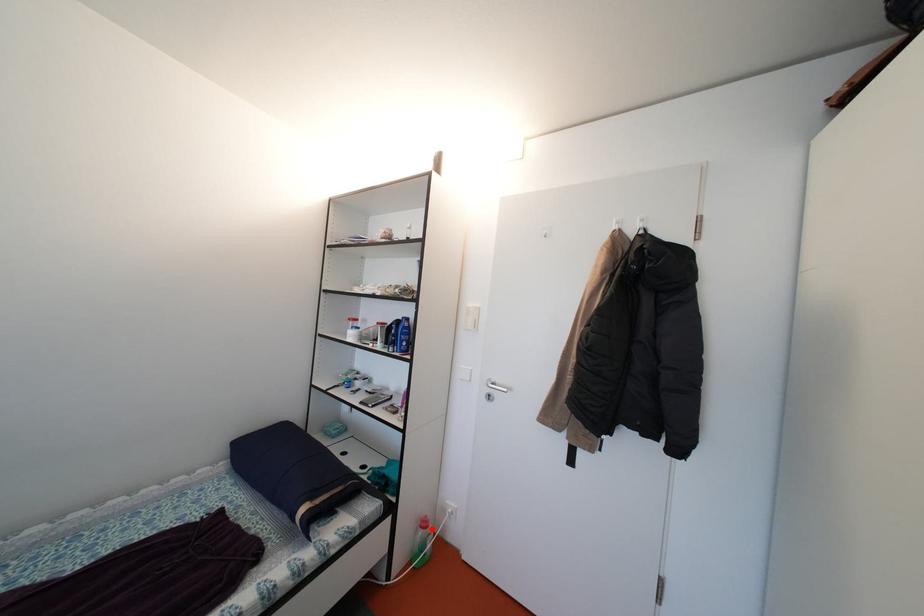
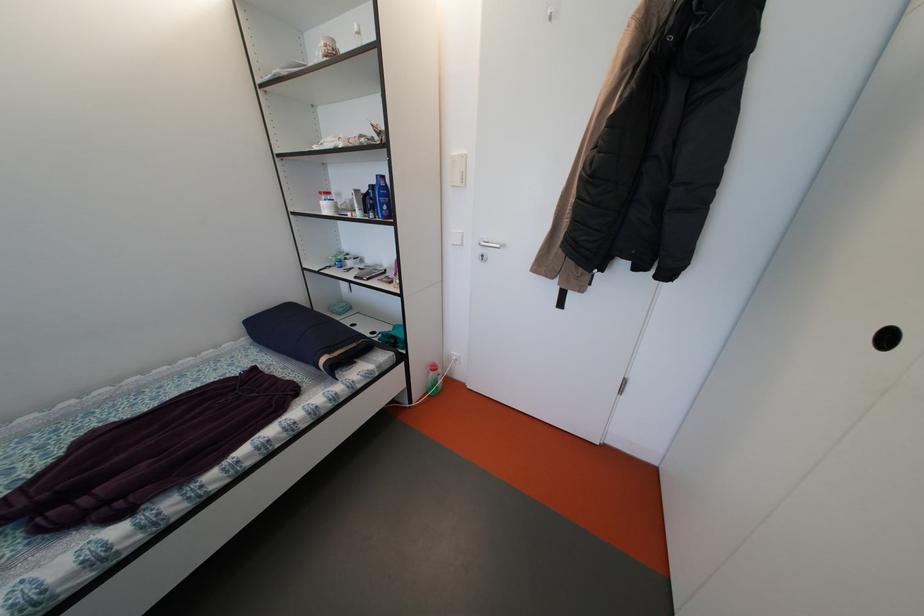
The point at the highlighted location is marked in the first image. Where is the corresponding point in the second image?

(441, 373)